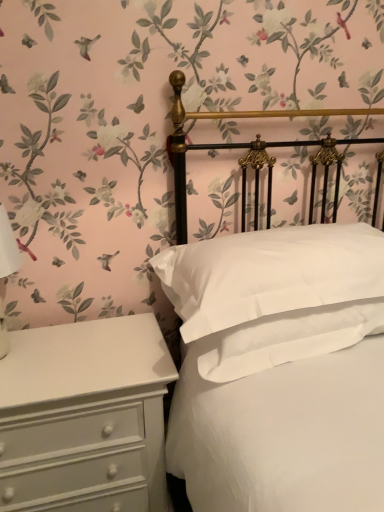
Question: Would you consider white painted wood chest of drawers at lower left to be distant from white matte bed at center?

Choices:
 (A) yes
 (B) no

Answer: (B)

Question: Can you confirm if white painted wood chest of drawers at lower left is positioned to the left of white matte bed at center?

Choices:
 (A) yes
 (B) no

Answer: (A)

Question: Is white painted wood chest of drawers at lower left positioned behind white matte bed at center?

Choices:
 (A) yes
 (B) no

Answer: (A)

Question: Would you say white painted wood chest of drawers at lower left contains white matte bed at center?

Choices:
 (A) yes
 (B) no

Answer: (B)

Question: Is white painted wood chest of drawers at lower left smaller than white matte bed at center?

Choices:
 (A) yes
 (B) no

Answer: (A)

Question: Can you confirm if white painted wood chest of drawers at lower left is bigger than white matte bed at center?

Choices:
 (A) yes
 (B) no

Answer: (B)

Question: Can you confirm if white smooth pillow at center is wider than white matte bed at center?

Choices:
 (A) no
 (B) yes

Answer: (A)

Question: Is white smooth pillow at center placed right next to white matte bed at center?

Choices:
 (A) no
 (B) yes

Answer: (A)

Question: Can you confirm if white smooth pillow at center is smaller than white matte bed at center?

Choices:
 (A) yes
 (B) no

Answer: (A)

Question: Would you say white smooth pillow at center contains white matte bed at center?

Choices:
 (A) yes
 (B) no

Answer: (B)

Question: From the image's perspective, is white smooth pillow at center on white matte bed at center?

Choices:
 (A) no
 (B) yes

Answer: (B)

Question: Considering the relative positions of white smooth pillow at center and white matte bed at center in the image provided, is white smooth pillow at center in front of white matte bed at center?

Choices:
 (A) yes
 (B) no

Answer: (B)

Question: Is white painted wood chest of drawers at lower left positioned in front of white smooth pillow at center?

Choices:
 (A) yes
 (B) no

Answer: (B)